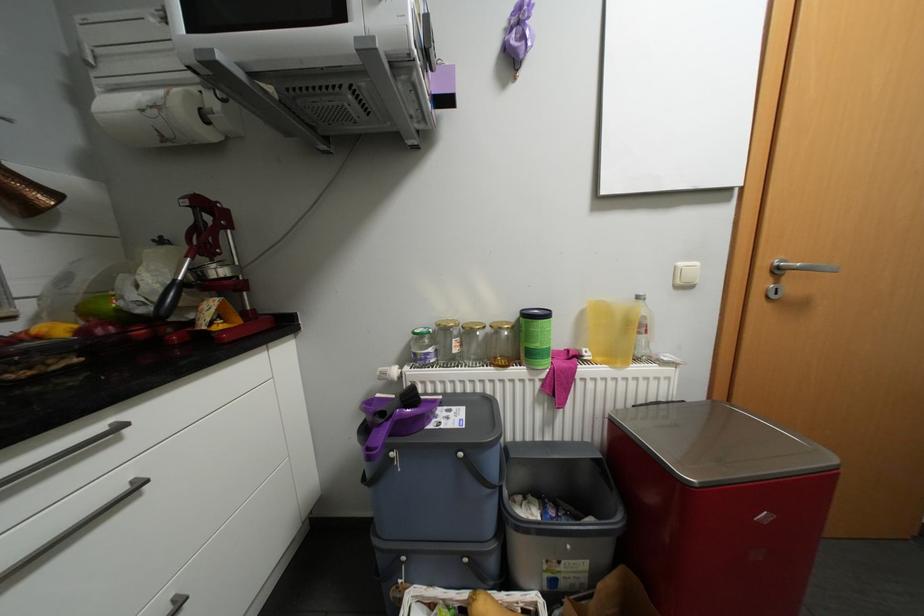
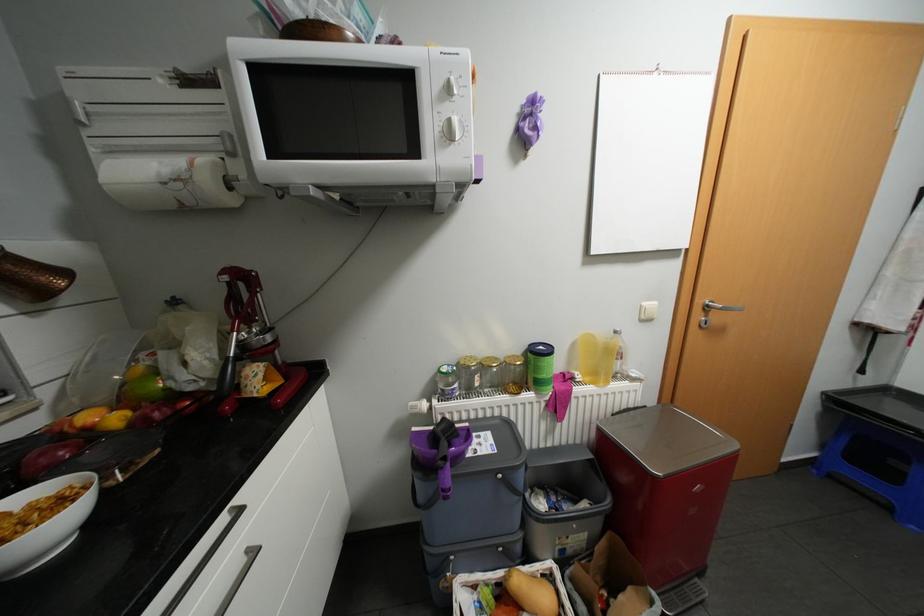
Locate, in the second image, the point that corresponds to the point at 646,358 in the first image.

(622, 377)